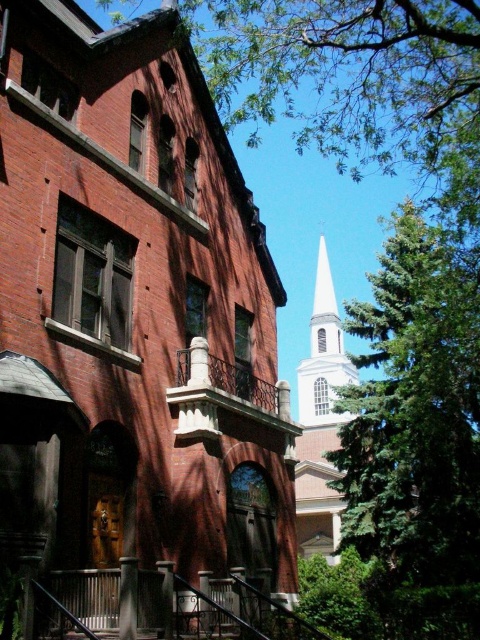
You are an architect designing a new city layout and need to ensure that the white steeple at upper center and the white smooth steeple at upper right are visible from a central plaza. Given their widths, which steeple would appear narrower when viewed from the plaza?

The white steeple at upper center appears narrower because its width is less than that of the white smooth steeple at upper right.